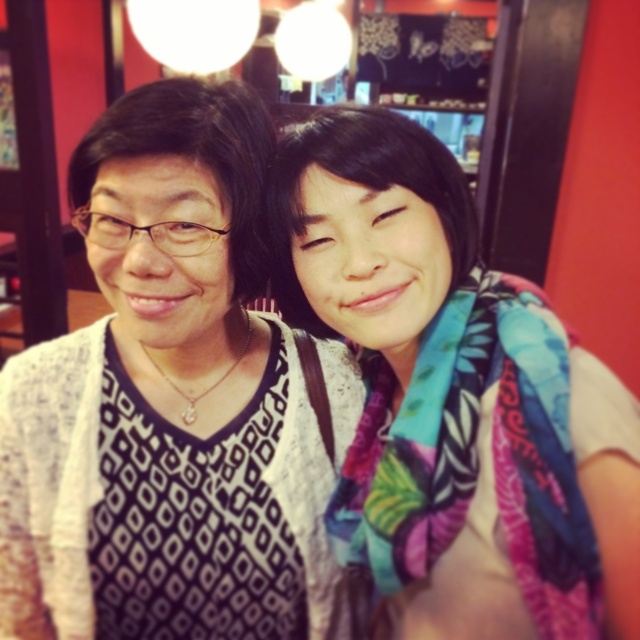
Question: Which object is closer to the camera taking this photo?

Choices:
 (A) white textured sweater at center
 (B) multicolored scarf at center

Answer: (A)

Question: Is white textured sweater at center to the right of multicolored scarf at center from the viewer's perspective?

Choices:
 (A) yes
 (B) no

Answer: (B)

Question: Does white textured sweater at center appear under multicolored scarf at center?

Choices:
 (A) yes
 (B) no

Answer: (A)

Question: Does white textured sweater at center appear under multicolored scarf at center?

Choices:
 (A) no
 (B) yes

Answer: (B)